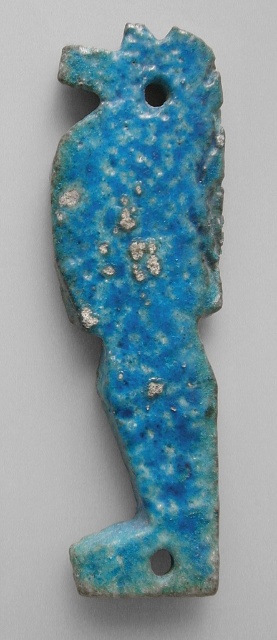
You are an archaeologist examining the ancient artifact. You notice two holes on the artifact. The first is the smooth blue hole at upper center, and the second is the blue speckled stone hole at center. Which hole is closer to you?

The smooth blue hole at upper center is closer to you because the blue speckled stone hole at center is positioned behind it.

You are examining the ancient artifact and notice two points marked on its surface. The first point is at coordinate point (106, 307), and the second is at point (168, 566). Which point is closer to you as you look at the artifact?

Point (106, 307) is further to the camera than point (168, 566), so the point closer to you is point (168, 566).

You are an archaeologist examining the ancient artifact. You notice the blue speckled stone fish at center and the smooth blue hole at upper center. Which object is located higher up in the image?

The smooth blue hole at upper center is higher up because the blue speckled stone fish at center is positioned under it.